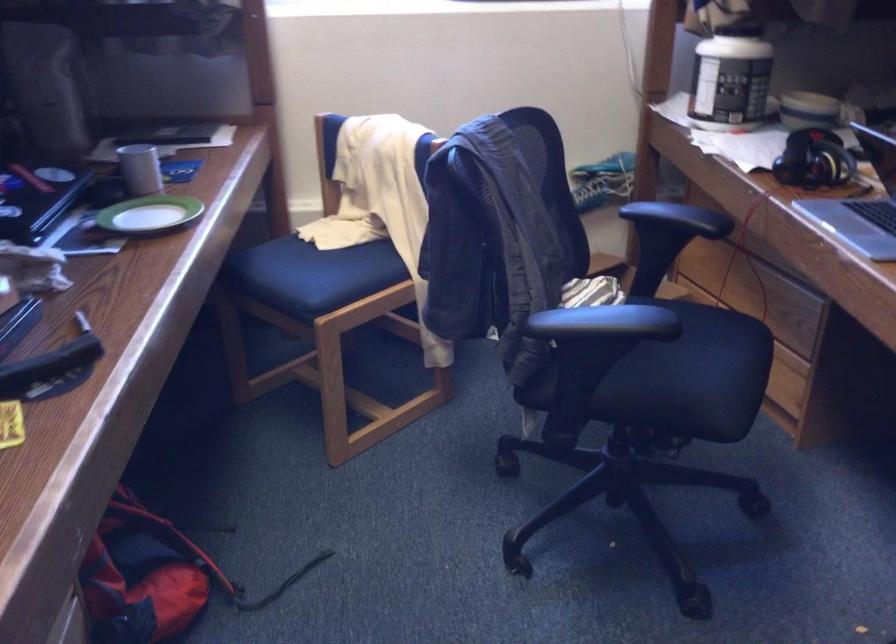
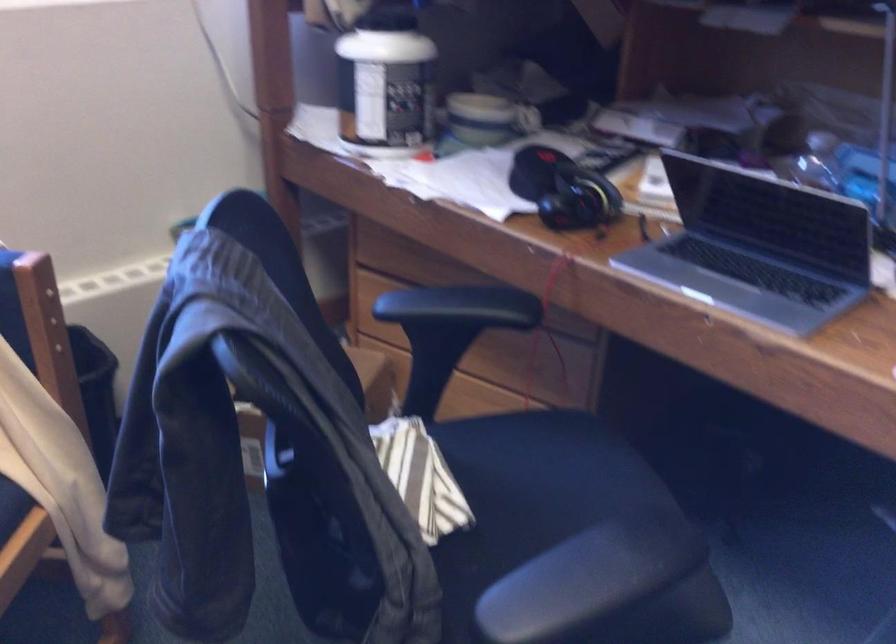
Question: The camera is either moving clockwise (left) or counter-clockwise (right) around the object. The first image is from the beginning of the video and the second image is from the end. Is the camera moving left or right when shooting the video?

Choices:
 (A) Left
 (B) Right

Answer: (A)